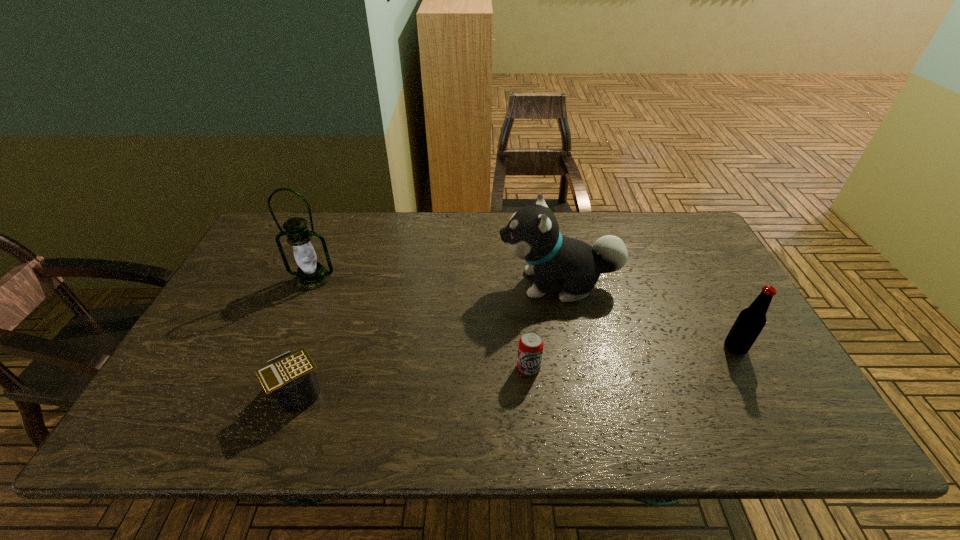
This screenshot has height=540, width=960. In order to click on lantern in this screenshot , I will do `click(310, 275)`.

This screenshot has height=540, width=960. I want to click on puppy, so click(x=532, y=234).

Where is `the third farthest object`? The width and height of the screenshot is (960, 540). the third farthest object is located at coordinates (750, 322).

Locate an element on the screen. This screenshot has height=540, width=960. the third shortest object is located at coordinates (750, 322).

Where is `soda can`? soda can is located at coordinates (530, 350).

Where is `calculator`? calculator is located at coordinates (290, 376).

The height and width of the screenshot is (540, 960). In order to click on free space located on the side where the lantern emits light in this screenshot , I will do `click(279, 358)`.

You are a GUI agent. You are given a task and a screenshot of the screen. Output one action in this format:
    pyautogui.click(x=<x>, y=<y>)
    Task: Click on the free space located at the face of the puppy
    The image size is (960, 540).
    Given the screenshot: What is the action you would take?
    pyautogui.click(x=422, y=284)

I want to click on vacant space located 0.370m at the face of the puppy, so click(x=371, y=284).

This screenshot has height=540, width=960. Identify the location of free space located 0.080m at the face of the puppy. (470, 284).